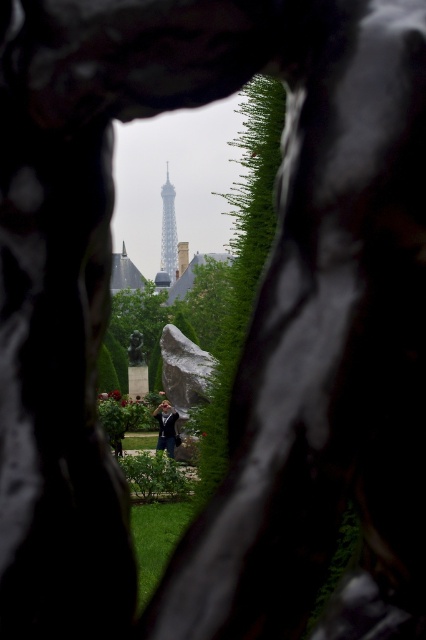
Find the location of `silver metallic eiffel tower at center`. silver metallic eiffel tower at center is located at coordinates (167, 236).

Which is more to the right, silver metallic eiffel tower at center or dark blue fabric jacket at center?

Positioned to the right is dark blue fabric jacket at center.

At what (x,y) coordinates should I click in order to perform the action: click on silver metallic eiffel tower at center. Please return your answer as a coordinate pair (x, y). Looking at the image, I should click on (167, 236).

Identify the location of silver metallic eiffel tower at center. (167, 236).